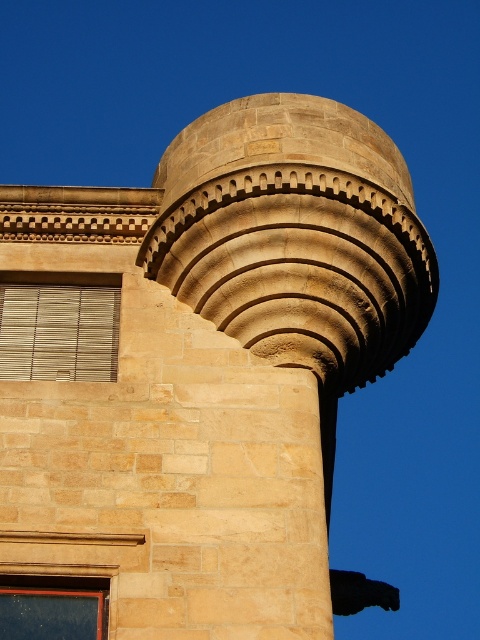
Can you confirm if wooden slats at left is wider than matte wooden window at lower left?

Yes, wooden slats at left is wider than matte wooden window at lower left.

Can you confirm if wooden slats at left is positioned to the left of matte wooden window at lower left?

Correct, you'll find wooden slats at left to the left of matte wooden window at lower left.

You are a GUI agent. You are given a task and a screenshot of the screen. Output one action in this format:
    pyautogui.click(x=<x>, y=<y>)
    Task: Click on the wooden slats at left
    The height and width of the screenshot is (640, 480).
    Given the screenshot: What is the action you would take?
    pyautogui.click(x=59, y=332)

At what (x,y) coordinates should I click in order to perform the action: click on wooden slats at left. Please return your answer as a coordinate pair (x, y). The height and width of the screenshot is (640, 480). Looking at the image, I should click on (59, 332).